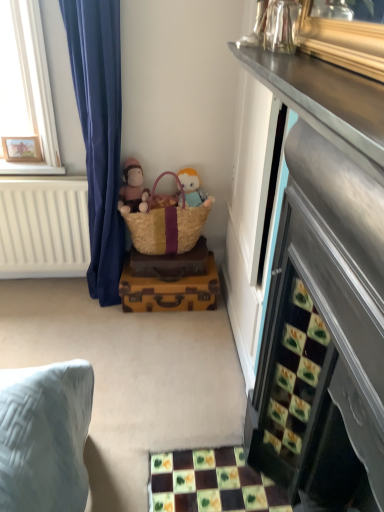
Question: From a real-world perspective, does vintage brown suitcase at center sit lower than soft brown plush at lower center?

Choices:
 (A) no
 (B) yes

Answer: (B)

Question: From the image's perspective, is vintage brown suitcase at center on top of soft brown plush at lower center?

Choices:
 (A) yes
 (B) no

Answer: (B)

Question: Is vintage brown suitcase at center oriented towards soft brown plush at lower center?

Choices:
 (A) no
 (B) yes

Answer: (A)

Question: Is vintage brown suitcase at center facing away from soft brown plush at lower center?

Choices:
 (A) no
 (B) yes

Answer: (A)

Question: Does vintage brown suitcase at center have a lesser height compared to soft brown plush at lower center?

Choices:
 (A) yes
 (B) no

Answer: (A)

Question: Is vintage brown suitcase at center outside soft brown plush at lower center?

Choices:
 (A) yes
 (B) no

Answer: (A)

Question: Is soft plush toy at center smaller than soft brown plush at lower center?

Choices:
 (A) no
 (B) yes

Answer: (B)

Question: Is soft plush toy at center far from soft brown plush at lower center?

Choices:
 (A) no
 (B) yes

Answer: (A)

Question: Does soft plush toy at center have a lesser width compared to soft brown plush at lower center?

Choices:
 (A) no
 (B) yes

Answer: (B)

Question: Is soft plush toy at center turned away from soft brown plush at lower center?

Choices:
 (A) no
 (B) yes

Answer: (A)

Question: Could you tell me if soft plush toy at center is turned towards soft brown plush at lower center?

Choices:
 (A) yes
 (B) no

Answer: (B)

Question: From a real-world perspective, does soft plush toy at center stand above soft brown plush at lower center?

Choices:
 (A) yes
 (B) no

Answer: (B)

Question: Is vintage brown suitcase at center at the left side of brown woven picnic basket at center?

Choices:
 (A) yes
 (B) no

Answer: (A)